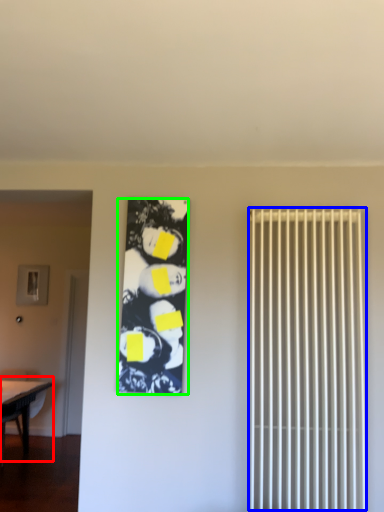
Question: Estimate the real-world distances between objects in this image. Which object is closer to table (highlighted by a red box), radiator (highlighted by a blue box) or couple (highlighted by a green box)?

Choices:
 (A) radiator
 (B) couple

Answer: (B)